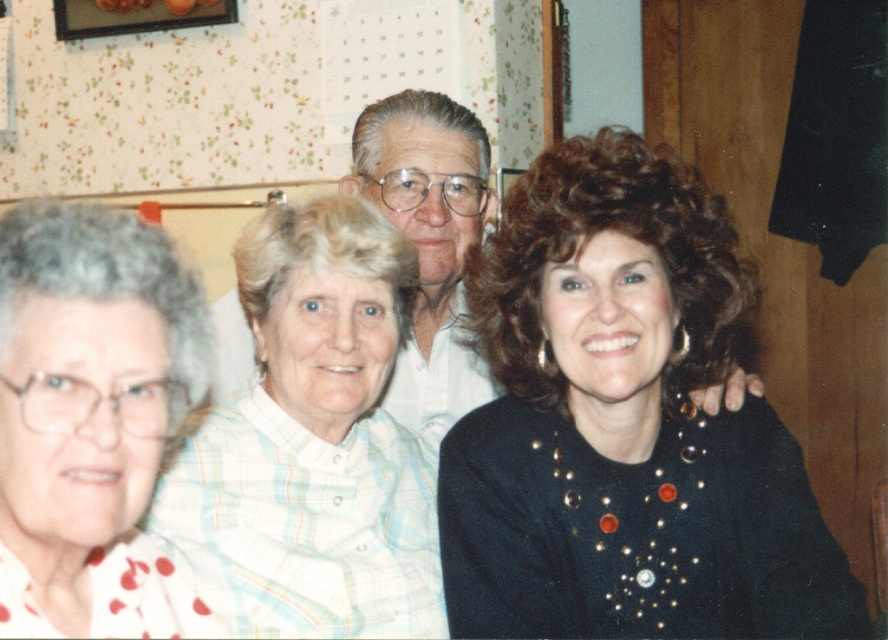
Question: Which of these objects is positioned farthest from the white dotted shirt at left?

Choices:
 (A) white shirt at center
 (B) black sequined dress at center

Answer: (A)

Question: Is the position of black sequined dress at center more distant than that of white shirt at center?

Choices:
 (A) no
 (B) yes

Answer: (A)

Question: Does black sequined dress at center have a lesser width compared to white plaid shirt at center?

Choices:
 (A) no
 (B) yes

Answer: (A)

Question: Is black sequined dress at center positioned behind white shirt at center?

Choices:
 (A) yes
 (B) no

Answer: (B)

Question: Estimate the real-world distances between objects in this image. Which object is farther from the white plaid shirt at center?

Choices:
 (A) black sequined dress at center
 (B) white dotted shirt at left

Answer: (B)

Question: Which object is closer to the camera taking this photo?

Choices:
 (A) white shirt at center
 (B) white plaid shirt at center
 (C) black sequined dress at center

Answer: (C)